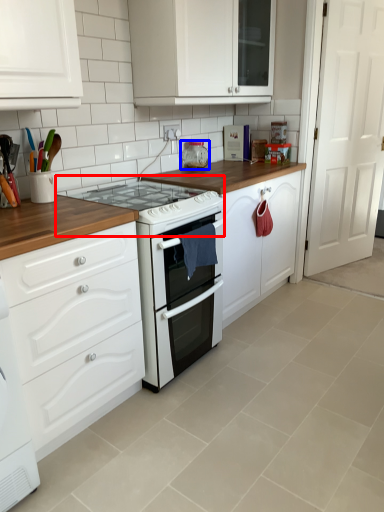
Question: Which object appears closest to the camera in this image, gas stove (highlighted by a red box) or appliance (highlighted by a blue box)?

Choices:
 (A) gas stove
 (B) appliance

Answer: (A)